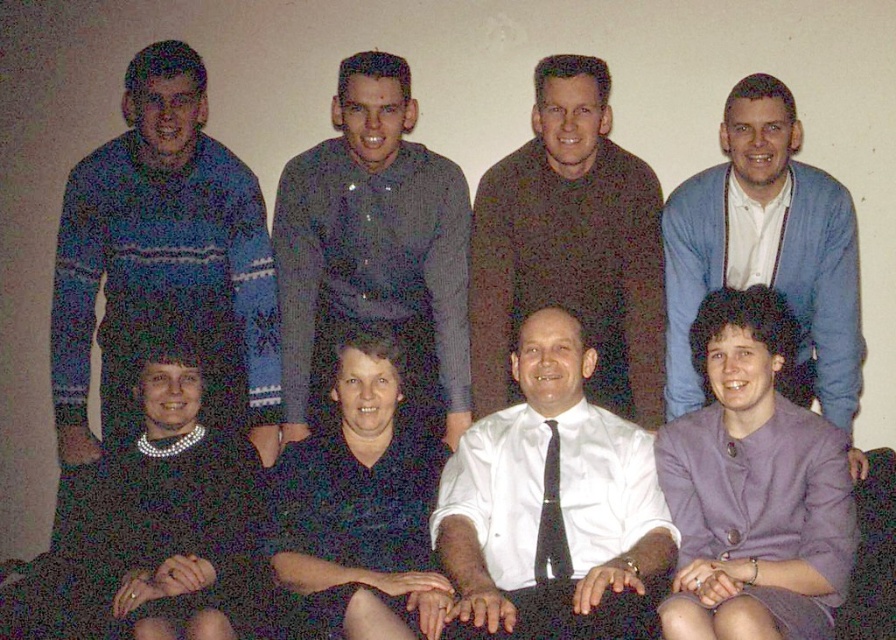
Consider the image. You are a photographer trying to adjust the lighting for a group photo. You notice two key subjects in the image, the dark gray textured shirt at center and the blue cardigan at upper right. Which of these two subjects is positioned higher in the frame?

The dark gray textured shirt at center is taller than the blue cardigan at upper right, so the dark gray textured shirt at center is positioned higher in the frame.